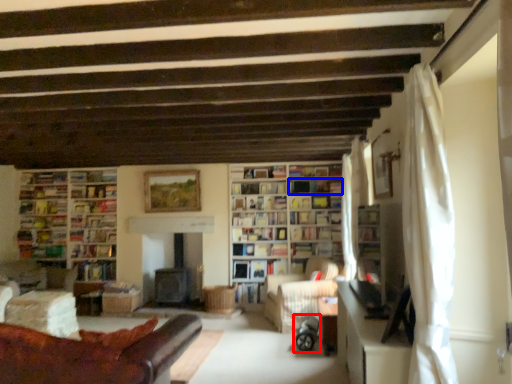
Question: Which object appears closest to the camera in this image, baby carriage (highlighted by a red box) or shelf (highlighted by a blue box)?

Choices:
 (A) baby carriage
 (B) shelf

Answer: (A)